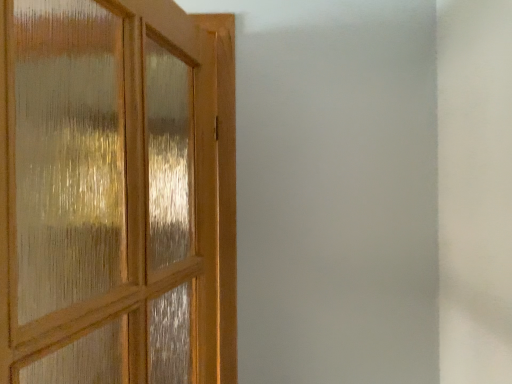
Measure the distance between wooden door at left and camera.

wooden door at left is 22.33 inches from camera.

This screenshot has height=384, width=512. What are the coordinates of `wooden door at left` in the screenshot? It's located at (116, 193).

Describe the element at coordinates (116, 193) in the screenshot. I see `wooden door at left` at that location.

Find the location of a particular element. The height and width of the screenshot is (384, 512). wooden door at left is located at coordinates (116, 193).